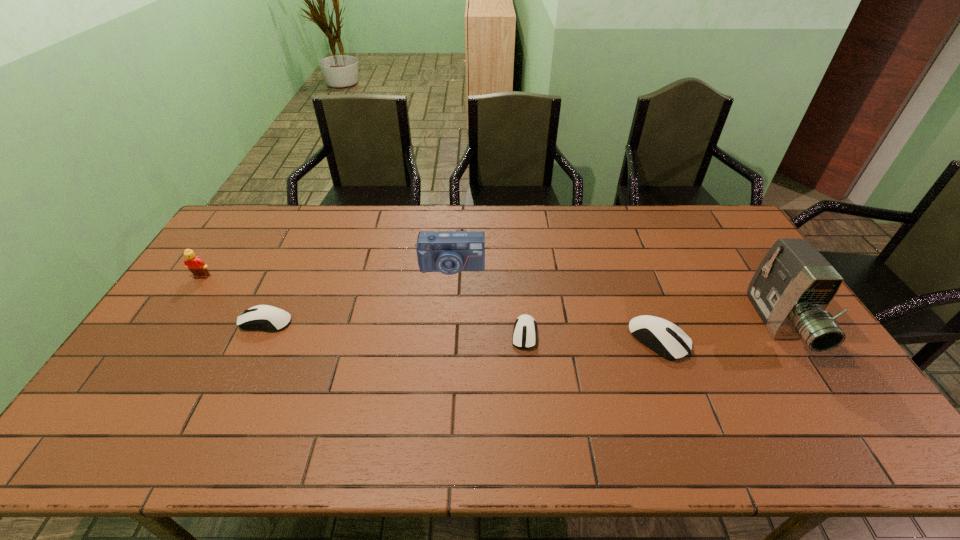
Please point a location where one more mouse_(computer_equipment) can be added evenly. Please provide its 2D coordinates. Your answer should be formatted as a tuple, i.e. [(x, y)], where the tuple contains the x and y coordinates of a point satisfying the conditions above.

[(394, 328)]